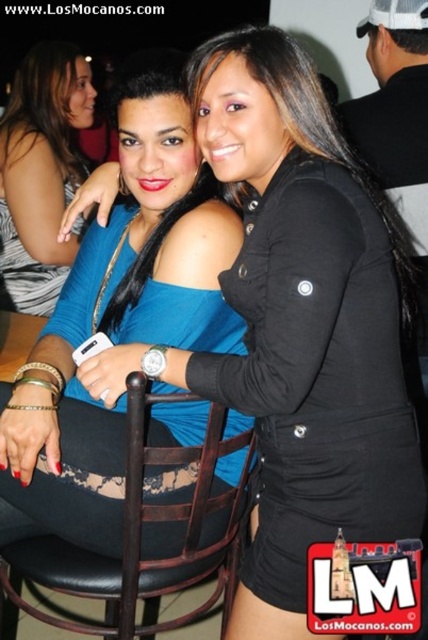
Can you confirm if blue matte dress at center is shorter than black leather chair at center?

No, blue matte dress at center is not shorter than black leather chair at center.

Which is behind, point (229, 228) or point (11, 588)?

Point (11, 588)

Which is in front, point (184, 202) or point (32, 614)?

Positioned in front is point (184, 202).

Identify the location of blue matte dress at center. This screenshot has width=428, height=640. (118, 316).

Is the position of black leather chair at center less distant than that of blue fabric top at center?

Yes, black leather chair at center is in front of blue fabric top at center.

Measure the distance between black leather chair at center and camera.

black leather chair at center is 36.67 inches away from camera.

Where is `black leather chair at center`? black leather chair at center is located at coordinates (148, 532).

What do you see at coordinates (118, 316) in the screenshot? This screenshot has height=640, width=428. I see `blue matte dress at center` at bounding box center [118, 316].

Based on the photo, is blue matte dress at center to the right of blue fabric top at center from the viewer's perspective?

Indeed, blue matte dress at center is positioned on the right side of blue fabric top at center.

Is point (70, 406) less distant than point (44, 76)?

Yes, it is in front of point (44, 76).

Find the location of a particular element. Image resolution: width=428 pixels, height=640 pixels. blue matte dress at center is located at coordinates (118, 316).